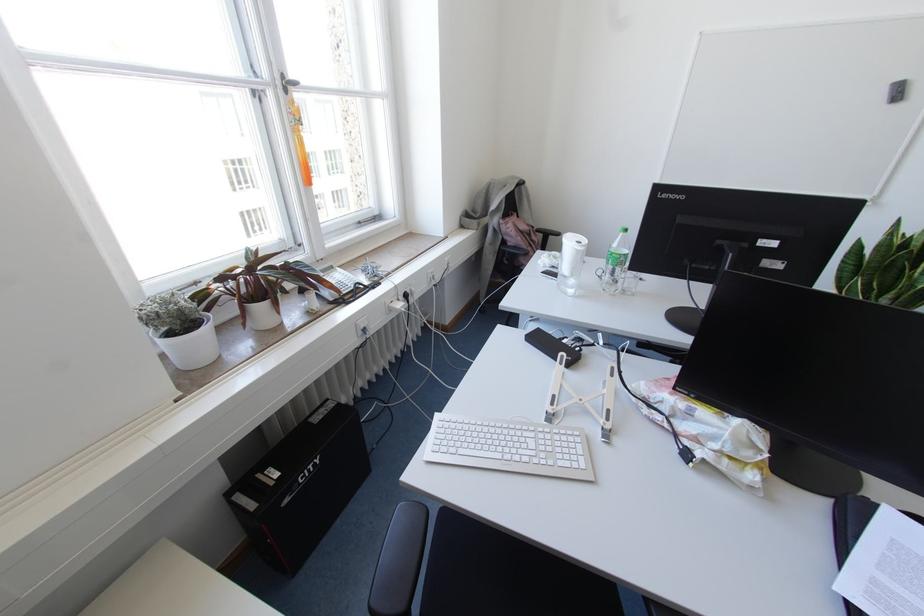
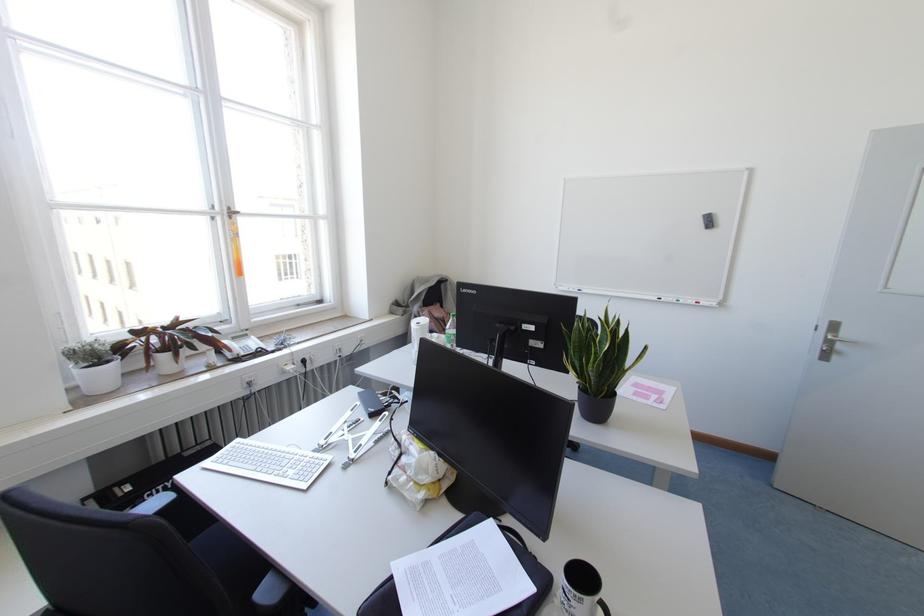
Locate, in the second image, the point that corresponds to [285,90] in the first image.

(229, 217)